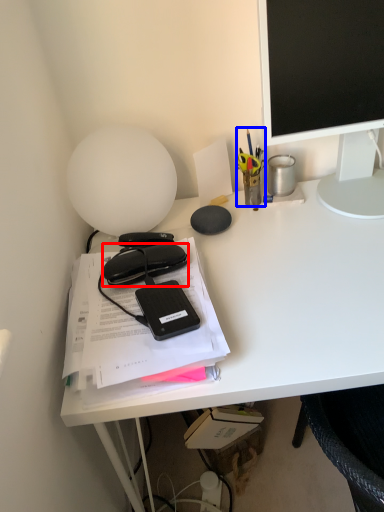
Question: Which object appears closest to the camera in this image, stationery (highlighted by a red box) or stationery (highlighted by a blue box)?

Choices:
 (A) stationery
 (B) stationery

Answer: (A)